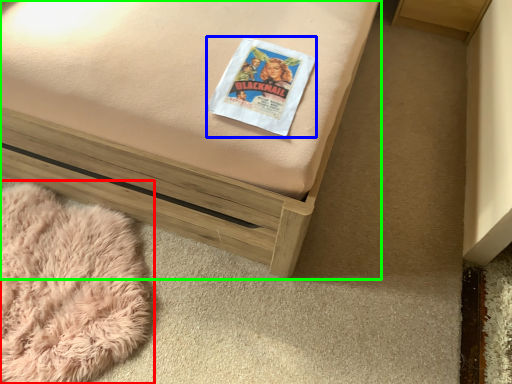
Question: Based on their relative distances, which object is farther from blanket (highlighted by a red box)? Choose from paperback book (highlighted by a blue box) and furniture (highlighted by a green box).

Choices:
 (A) paperback book
 (B) furniture

Answer: (A)